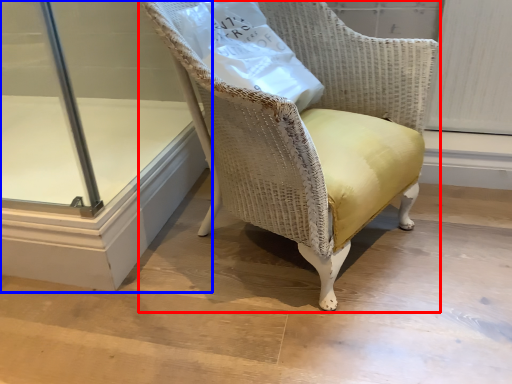
Question: Which of the following is the farthest to the observer, chair (highlighted by a red box) or glass door (highlighted by a blue box)?

Choices:
 (A) chair
 (B) glass door

Answer: (B)